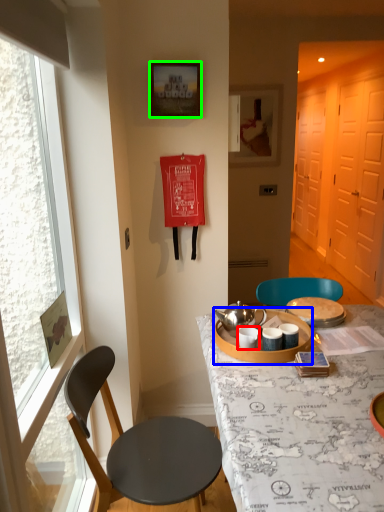
Question: Which is farther away from coffee cup (highlighted by a red box)? tableware (highlighted by a blue box) or picture frame (highlighted by a green box)?

Choices:
 (A) tableware
 (B) picture frame

Answer: (B)